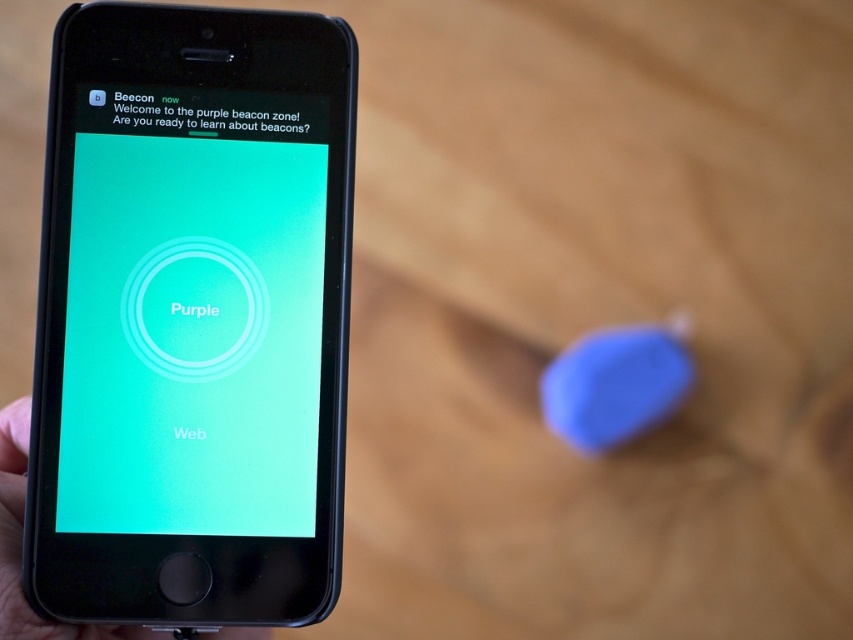
Question: Does purple matte beacon at upper left have a larger size compared to matte black phone at lower left?

Choices:
 (A) yes
 (B) no

Answer: (B)

Question: Which point is closer to the camera?

Choices:
 (A) (114, 412)
 (B) (4, 513)

Answer: (A)

Question: Which of the following is the closest to the observer?

Choices:
 (A) (271, 276)
 (B) (94, 113)

Answer: (A)

Question: Which of these objects is positioned farthest from the purple matte beacon at upper left?

Choices:
 (A) matte black phone at lower left
 (B) matte black smartphone at left

Answer: (A)

Question: Where is purple matte beacon at upper left located in relation to matte black phone at lower left in the image?

Choices:
 (A) left
 (B) right

Answer: (B)

Question: Can you confirm if purple matte beacon at upper left is positioned to the left of matte black phone at lower left?

Choices:
 (A) yes
 (B) no

Answer: (B)